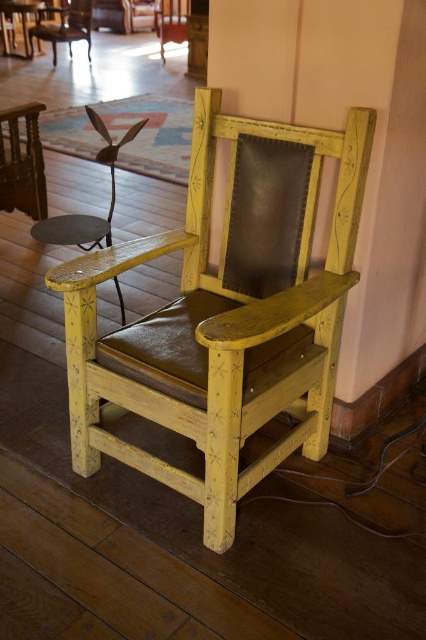
Question: Which point is farther to the camera?

Choices:
 (A) yellow painted wood chair at center
 (B) yellow painted wood armchair at center

Answer: (B)

Question: Among these points, which one is farthest from the camera?

Choices:
 (A) (57, 289)
 (B) (75, 8)

Answer: (B)

Question: Is yellow painted wood chair at center thinner than yellow painted wood armchair at center?

Choices:
 (A) no
 (B) yes

Answer: (A)

Question: Which point is closer to the camera?

Choices:
 (A) (75, 1)
 (B) (114, 458)

Answer: (B)

Question: Is yellow painted wood chair at center smaller than yellow painted wood armchair at center?

Choices:
 (A) no
 (B) yes

Answer: (A)

Question: Does yellow painted wood chair at center have a greater width compared to yellow painted wood armchair at center?

Choices:
 (A) no
 (B) yes

Answer: (B)